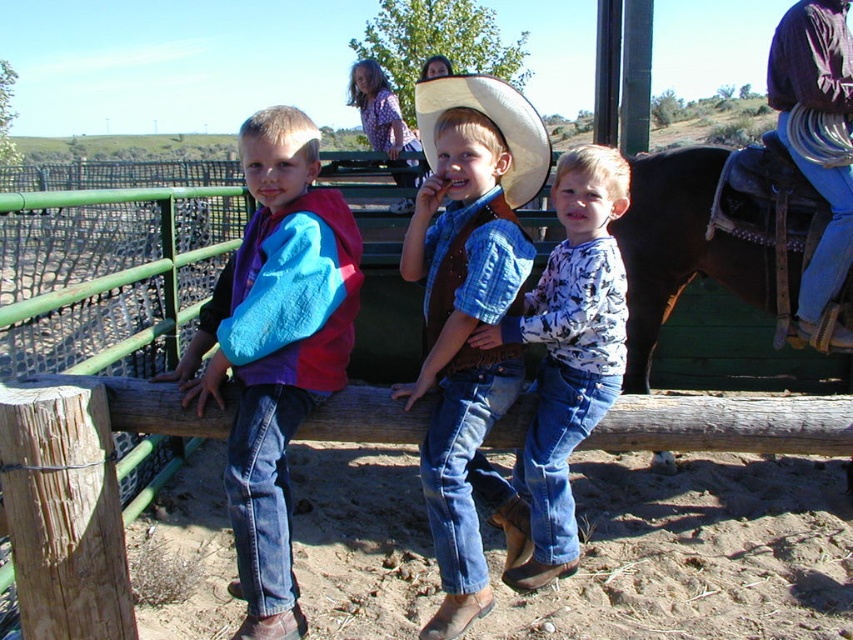
Question: Can you confirm if white printed shirt at center is positioned above brown leather saddle at upper right?

Choices:
 (A) yes
 (B) no

Answer: (B)

Question: Which object is positioned closest to the white straw hat at center?

Choices:
 (A) white printed shirt at center
 (B) denim jeans at center

Answer: (B)

Question: Is brown leather saddle at upper right thinner than white straw hat at center?

Choices:
 (A) yes
 (B) no

Answer: (B)

Question: Which point is farther to the camera?

Choices:
 (A) white straw hat at center
 (B) brown leather saddle at upper right

Answer: (B)

Question: Estimate the real-world distances between objects in this image. Which object is farther from the brushed denim jacket at left?

Choices:
 (A) brown leather saddle at upper right
 (B) white printed shirt at center

Answer: (A)

Question: Is white printed shirt at center to the right of brown leather saddle at upper right from the viewer's perspective?

Choices:
 (A) yes
 (B) no

Answer: (B)